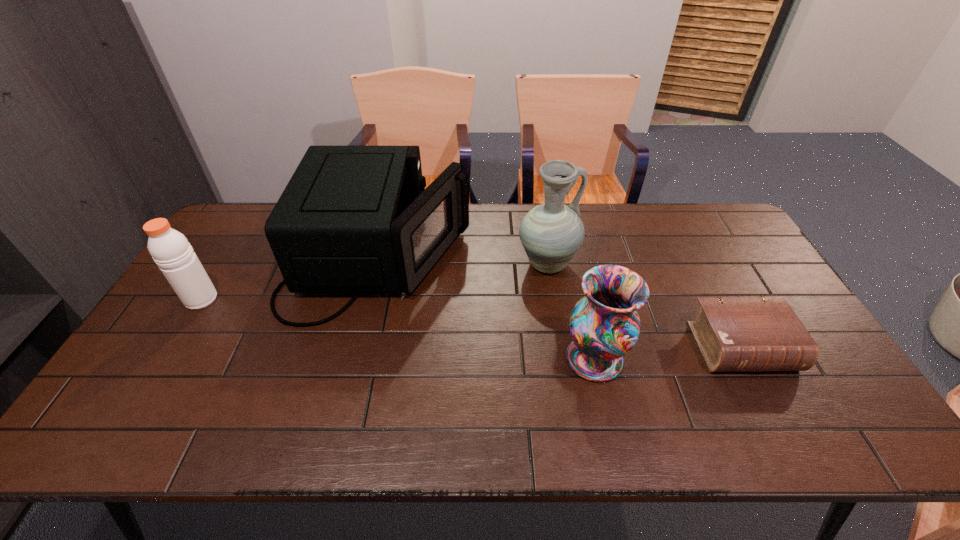
This screenshot has height=540, width=960. Identify the location of the tallest object. (551, 233).

The height and width of the screenshot is (540, 960). Identify the location of shaker. (173, 254).

In order to click on the fourth object from right to left in this screenshot , I will do `click(352, 219)`.

At what (x,y) coordinates should I click in order to perform the action: click on vase. Please return your answer as a coordinate pair (x, y). Looking at the image, I should click on (604, 325).

This screenshot has width=960, height=540. I want to click on Bible, so click(x=734, y=334).

Identify the location of the shortest object. The height and width of the screenshot is (540, 960). (734, 334).

Identify the location of vacant space located on the handle side of the tallest object. This screenshot has width=960, height=540. (644, 265).

Locate an element on the screen. The image size is (960, 540). free spot located on the back of the leftmost object is located at coordinates (235, 245).

Image resolution: width=960 pixels, height=540 pixels. What are the coordinates of `vacant space located 0.290m with the door open on the microwave oven` in the screenshot? It's located at (560, 258).

Image resolution: width=960 pixels, height=540 pixels. What are the coordinates of `vacant area located 0.180m on the back of the vase` in the screenshot? It's located at (578, 287).